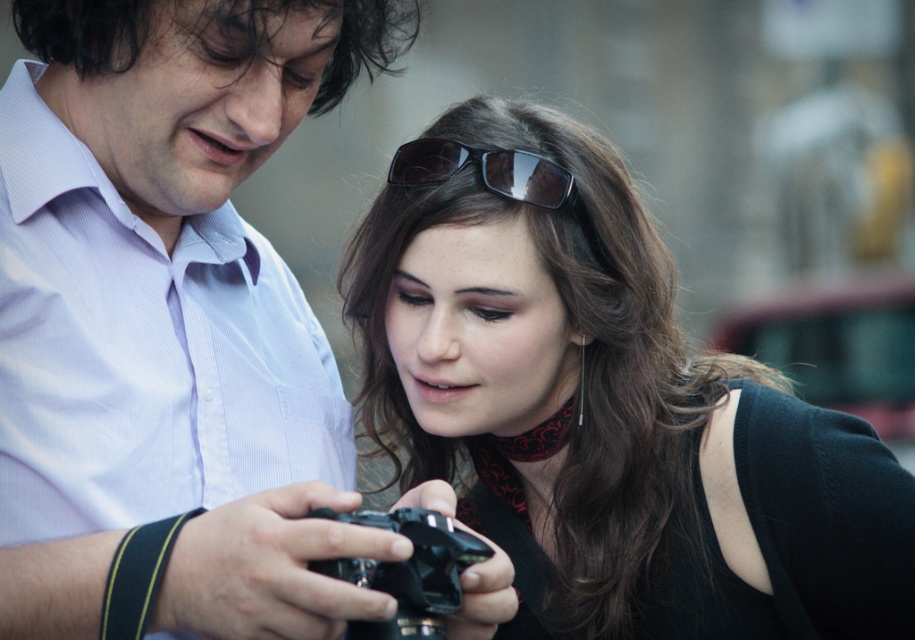
Question: Which of the following is the farthest from the observer?

Choices:
 (A) (428, 173)
 (B) (199, 13)

Answer: (A)

Question: Is black plastic camera at center positioned before black shiny sunglasses at upper center?

Choices:
 (A) no
 (B) yes

Answer: (B)

Question: Does matte black camera at center have a larger size compared to matte white shirt at upper left?

Choices:
 (A) yes
 (B) no

Answer: (B)

Question: Is matte black camera at center to the right of matte black hair at upper left from the viewer's perspective?

Choices:
 (A) yes
 (B) no

Answer: (A)

Question: Considering the real-world distances, which object is farthest from the black plastic camera at center?

Choices:
 (A) black shiny sunglasses at upper center
 (B) matte black hair at upper left
 (C) matte white shirt at upper left

Answer: (B)

Question: Which object is farther from the camera taking this photo?

Choices:
 (A) matte black camera at center
 (B) black shiny sunglasses at upper center
 (C) matte black hair at upper left
 (D) black plastic camera at center

Answer: (B)